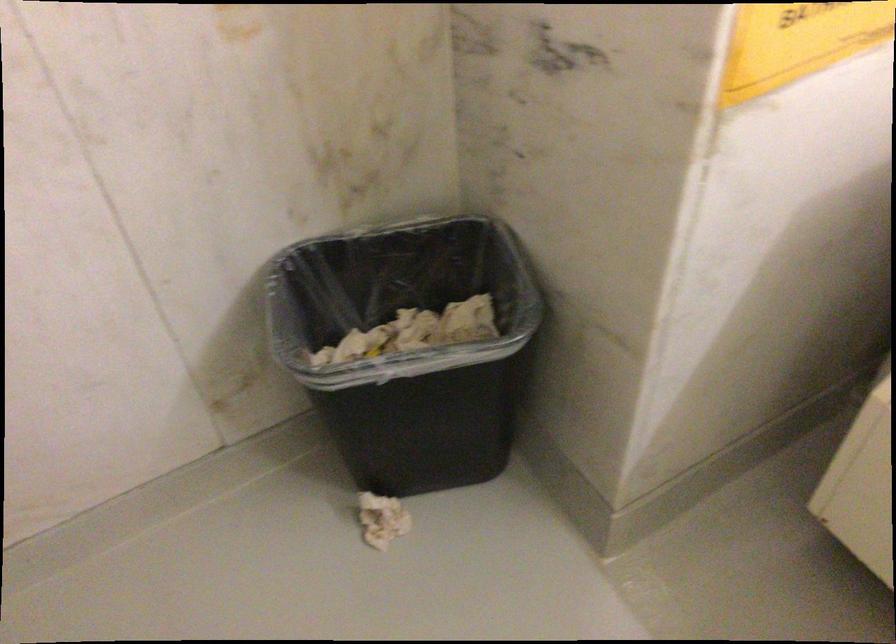
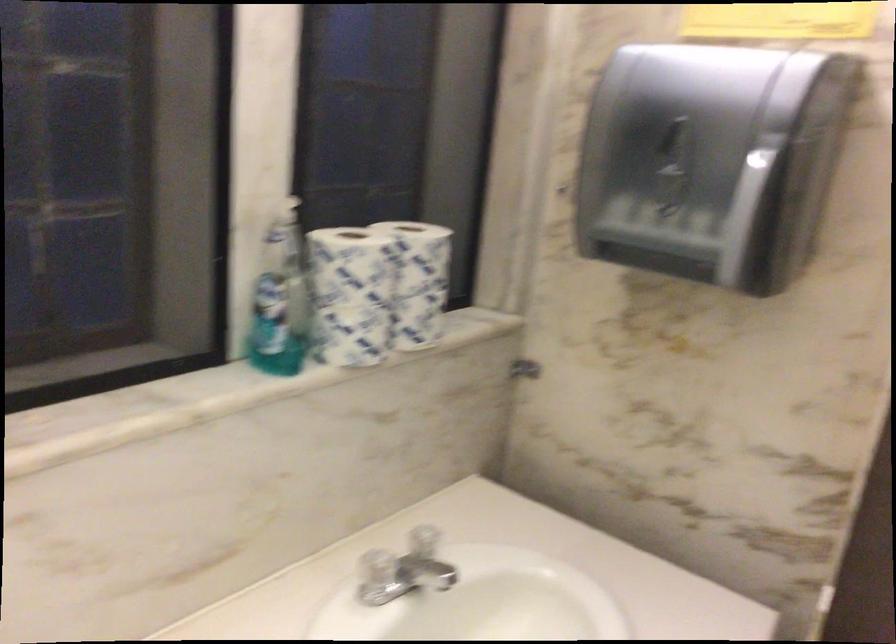
The first image is from the beginning of the video and the second image is from the end. How did the camera likely rotate when shooting the video?

The camera rotated toward right-down.